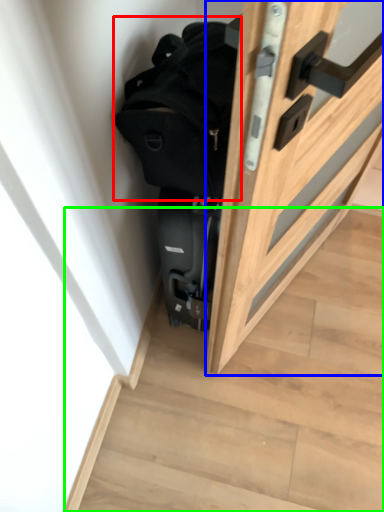
Question: Based on their relative distances, which object is nearer to backpack (highlighted by a red box)? Choose from door (highlighted by a blue box) and stairwell (highlighted by a green box).

Choices:
 (A) door
 (B) stairwell

Answer: (A)